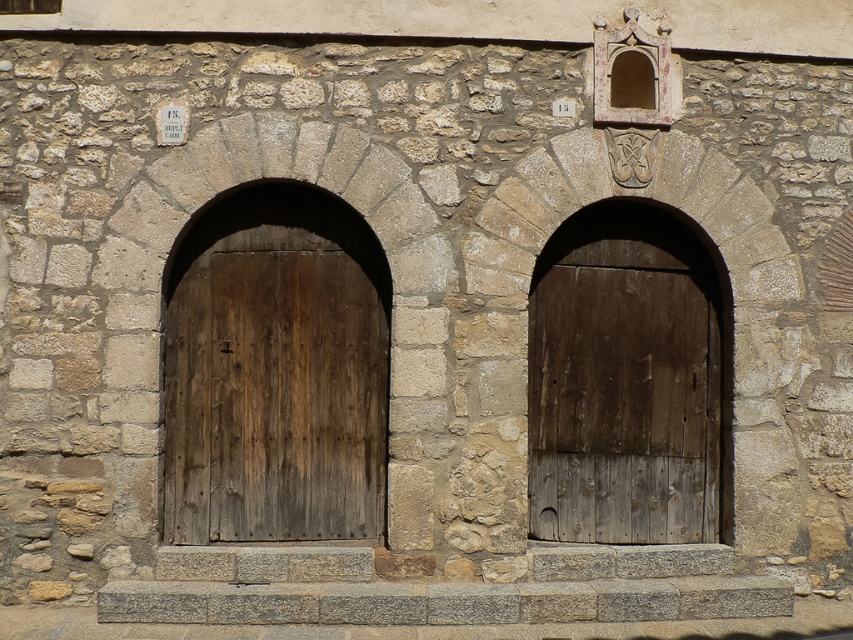
Question: Does weathered wood door at center lie behind dark brown wooden door at center?

Choices:
 (A) yes
 (B) no

Answer: (B)

Question: Can you confirm if weathered wood door at center is thinner than dark brown wooden door at center?

Choices:
 (A) no
 (B) yes

Answer: (A)

Question: Is weathered wood door at center above dark brown wooden door at center?

Choices:
 (A) yes
 (B) no

Answer: (A)

Question: Which point appears farthest from the camera in this image?

Choices:
 (A) (294, 257)
 (B) (566, 444)

Answer: (B)